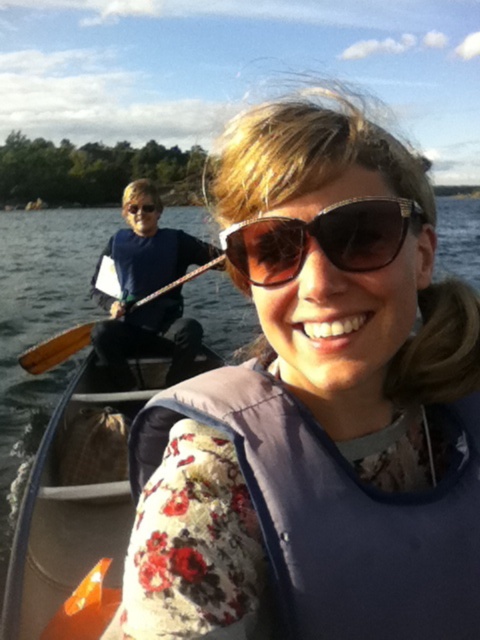
You are a photographer trying to capture a closeup of the blue fabric shirt at left and the sunglasses at center. Which object should you zoom in on to ensure it fills the frame without cropping?

The blue fabric shirt at left is bigger than sunglasses at center, so you should zoom in on the blue fabric shirt at left to ensure it fills the frame without cropping.

You are standing at the center of the image and want to move towards the two points labeled as point (93, 280) and point (52, 340). Which point should you reach first?

Point (52, 340) should be reached first because it is in front of point (93, 280).